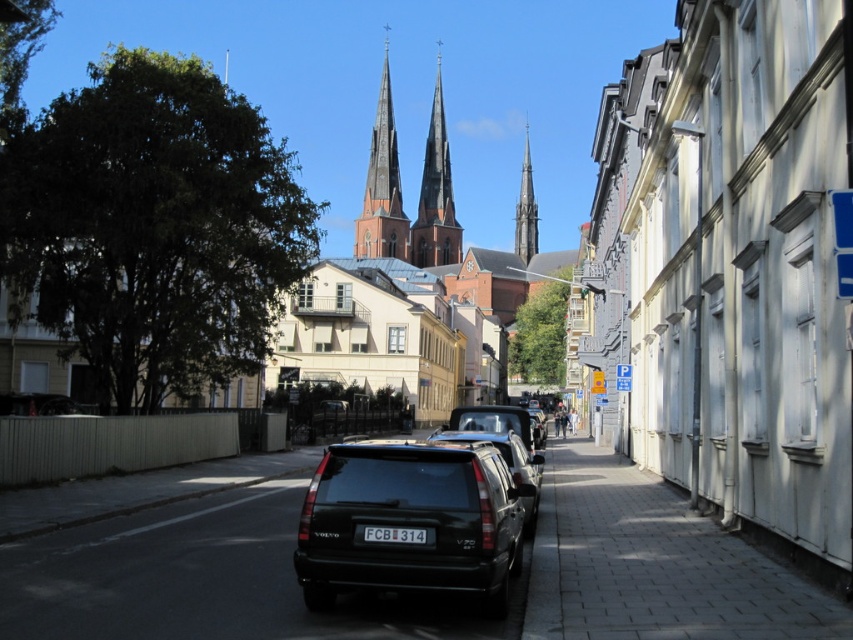
Question: Considering the real-world distances, which object is closest to the smooth stone spire at center?

Choices:
 (A) smooth red brick tower at center
 (B) blue plastic parking sign at center
 (C) smooth concrete sidewalk at center

Answer: (A)

Question: Observing the image, what is the correct spatial positioning of smooth red brick tower at center in reference to black plastic license plate at center?

Choices:
 (A) right
 (B) left

Answer: (B)

Question: Based on their relative distances, which object is nearer to the black matte suv at center?

Choices:
 (A) smooth stone spire at center
 (B) blue plastic parking sign at center
 (C) smooth red brick tower at center

Answer: (B)

Question: Can you confirm if black matte suv at center is thinner than blue plastic parking sign at center?

Choices:
 (A) no
 (B) yes

Answer: (A)

Question: Is smooth stone spire at center positioned behind blue plastic parking sign at center?

Choices:
 (A) yes
 (B) no

Answer: (A)

Question: Among these points, which one is farthest from the camera?

Choices:
 (A) (630, 380)
 (B) (422, 536)
 (C) (425, 198)
 (D) (500, 557)

Answer: (C)